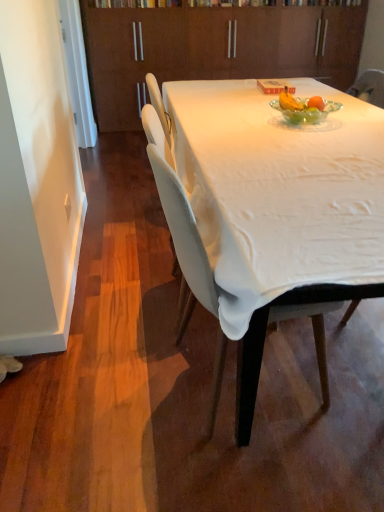
Question: Can you confirm if white fabric chair at center is wider than brown wood cabinetry at upper center?

Choices:
 (A) yes
 (B) no

Answer: (A)

Question: Is white fabric chair at center beside brown wood cabinetry at upper center?

Choices:
 (A) yes
 (B) no

Answer: (B)

Question: Can you confirm if white fabric chair at center is positioned to the left of brown wood cabinetry at upper center?

Choices:
 (A) no
 (B) yes

Answer: (B)

Question: Is white fabric chair at center closer to camera compared to brown wood cabinetry at upper center?

Choices:
 (A) yes
 (B) no

Answer: (A)

Question: Can you confirm if white fabric chair at center is thinner than brown wood cabinetry at upper center?

Choices:
 (A) yes
 (B) no

Answer: (B)

Question: From the image's perspective, is brown wood cabinetry at upper center above or below white cloth-covered table at center?

Choices:
 (A) above
 (B) below

Answer: (A)

Question: Visually, is brown wood cabinetry at upper center positioned to the left or to the right of white cloth-covered table at center?

Choices:
 (A) left
 (B) right

Answer: (A)

Question: From their relative heights in the image, would you say brown wood cabinetry at upper center is taller or shorter than white cloth-covered table at center?

Choices:
 (A) short
 (B) tall

Answer: (B)

Question: Does point (129, 83) appear closer or farther from the camera than point (185, 133)?

Choices:
 (A) closer
 (B) farther

Answer: (B)

Question: In terms of width, does white fabric chair at center look wider or thinner when compared to white cloth-covered table at center?

Choices:
 (A) wide
 (B) thin

Answer: (B)

Question: From a real-world perspective, is white fabric chair at center positioned above or below white cloth-covered table at center?

Choices:
 (A) below
 (B) above

Answer: (A)

Question: Would you say white fabric chair at center is to the left or to the right of white cloth-covered table at center in the picture?

Choices:
 (A) right
 (B) left

Answer: (B)

Question: Is white fabric chair at center spatially inside white cloth-covered table at center, or outside of it?

Choices:
 (A) outside
 (B) inside

Answer: (A)

Question: Considering the positions of white fabric chair at center and brown wood cabinetry at upper center in the image, is white fabric chair at center wider or thinner than brown wood cabinetry at upper center?

Choices:
 (A) thin
 (B) wide

Answer: (B)

Question: From a real-world perspective, is white fabric chair at center positioned above or below brown wood cabinetry at upper center?

Choices:
 (A) below
 (B) above

Answer: (A)